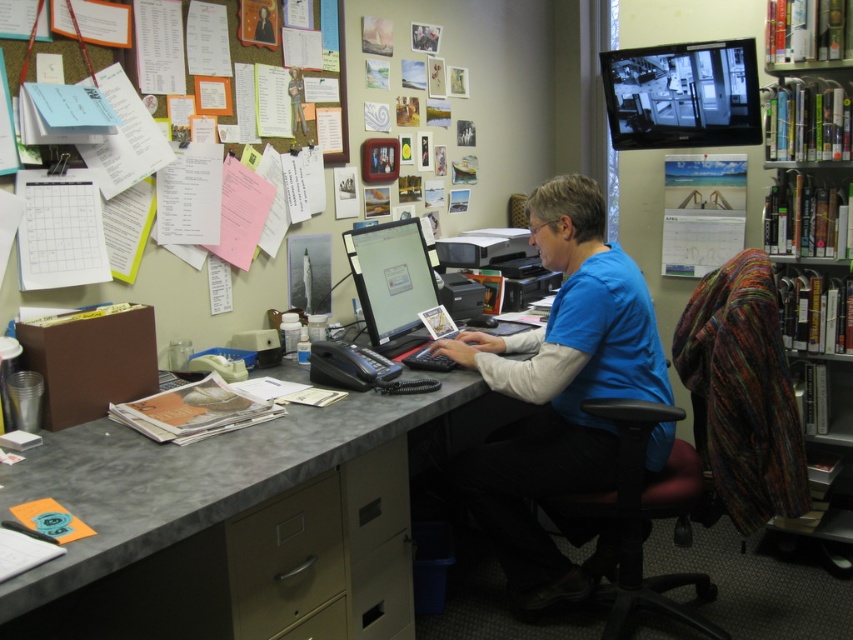
Is point (141, 580) positioned after point (822, 337)?

That is False.

Between point (218, 588) and point (808, 64), which one is positioned behind?

Positioned behind is point (808, 64).

At what (x,y) coordinates should I click in order to perform the action: click on gray laminate desk at center. Please return your answer as a coordinate pair (x, y). Looking at the image, I should click on (241, 520).

Can you confirm if gray laminate desk at center is taller than blue cotton shirt at center?

No, gray laminate desk at center is not taller than blue cotton shirt at center.

Which is above, gray laminate desk at center or blue cotton shirt at center?

Positioned higher is blue cotton shirt at center.

Between point (340, 596) and point (546, 209), which one is positioned behind?

The point (546, 209) is behind.

Locate an element on the screen. The height and width of the screenshot is (640, 853). gray laminate desk at center is located at coordinates (241, 520).

Is point (143, 536) farther from viewer compared to point (633, 124)?

That is False.

Measure the distance between point (374,595) and camera.

Point (374,595) and camera are 6.45 feet apart.

Is point (125, 474) in front of point (670, 112)?

Yes, it is in front of point (670, 112).

At what (x,y) coordinates should I click in order to perform the action: click on gray laminate desk at center. Please return your answer as a coordinate pair (x, y). The width and height of the screenshot is (853, 640). Looking at the image, I should click on (241, 520).